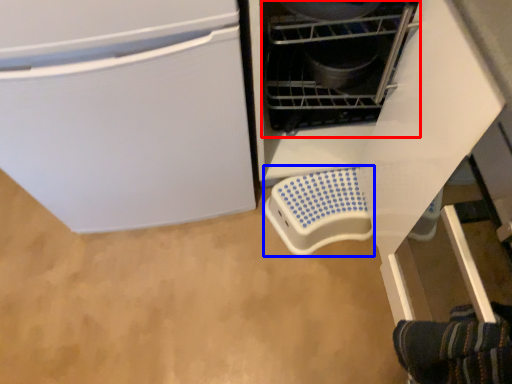
Question: Which object appears closest to the camera in this image, appliance (highlighted by a red box) or appliance (highlighted by a blue box)?

Choices:
 (A) appliance
 (B) appliance

Answer: (A)